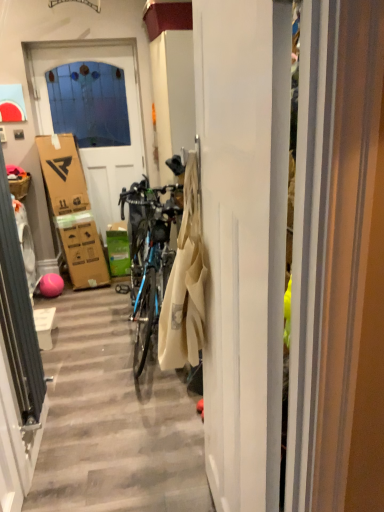
Question: From the image's perspective, is brown cardboard picnic basket at left located above white matte door at upper left, which ranks as the 2th door in front-to-back order?

Choices:
 (A) no
 (B) yes

Answer: (A)

Question: Considering the relative sizes of brown cardboard picnic basket at left and white matte door at upper left, which is the first door from left to right, in the image provided, is brown cardboard picnic basket at left wider than white matte door at upper left, which is the first door from left to right,?

Choices:
 (A) yes
 (B) no

Answer: (A)

Question: Does brown cardboard picnic basket at left have a smaller size compared to white matte door at upper left, the 1th door in the back-to-front sequence?

Choices:
 (A) no
 (B) yes

Answer: (B)

Question: Is white matte door at upper left, the 1th door in the back-to-front sequence, inside brown cardboard picnic basket at left?

Choices:
 (A) yes
 (B) no

Answer: (B)

Question: Does brown cardboard picnic basket at left have a lesser width compared to white matte door at upper left, the 1th door in the back-to-front sequence?

Choices:
 (A) no
 (B) yes

Answer: (A)

Question: Are brown cardboard picnic basket at left and white matte door at upper left, which is the first door from left to right, beside each other?

Choices:
 (A) no
 (B) yes

Answer: (A)

Question: Is the position of green cardboard box at center more distant than that of white glossy washing machine at left?

Choices:
 (A) yes
 (B) no

Answer: (A)

Question: Does green cardboard box at center contain white glossy washing machine at left?

Choices:
 (A) no
 (B) yes

Answer: (A)

Question: From a real-world perspective, is green cardboard box at center on top of white glossy washing machine at left?

Choices:
 (A) no
 (B) yes

Answer: (A)

Question: Considering the relative sizes of green cardboard box at center and white glossy washing machine at left in the image provided, is green cardboard box at center thinner than white glossy washing machine at left?

Choices:
 (A) no
 (B) yes

Answer: (A)

Question: Is green cardboard box at center in contact with white glossy washing machine at left?

Choices:
 (A) no
 (B) yes

Answer: (A)

Question: Considering the relative sizes of green cardboard box at center and white glossy washing machine at left in the image provided, is green cardboard box at center shorter than white glossy washing machine at left?

Choices:
 (A) yes
 (B) no

Answer: (A)

Question: From a real-world perspective, is green cardboard box at center located higher than white matte door at upper left, which is the first door from left to right?

Choices:
 (A) no
 (B) yes

Answer: (A)